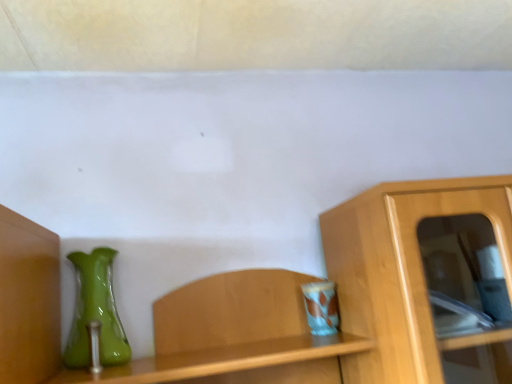
The width and height of the screenshot is (512, 384). Describe the element at coordinates (95, 311) in the screenshot. I see `green glass vase at left` at that location.

Where is `green glass vase at left`? The height and width of the screenshot is (384, 512). green glass vase at left is located at coordinates (95, 311).

What is the approximate height of green glass vase at left?

green glass vase at left is 12.17 inches in height.

Measure the distance between green glass vase at left and camera.

green glass vase at left and camera are 1.09 meters apart from each other.

Identify the location of green glass vase at left. (95, 311).